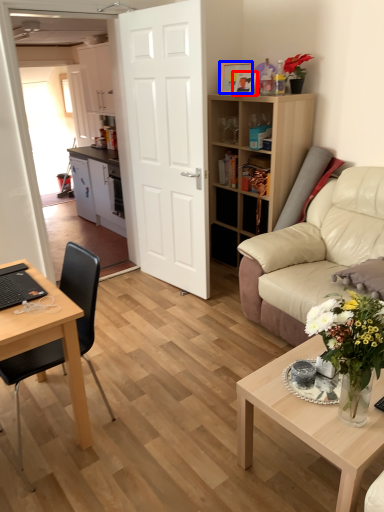
Question: Among these objects, which one is farthest to the camera, picture frame (highlighted by a red box) or picture frame (highlighted by a blue box)?

Choices:
 (A) picture frame
 (B) picture frame

Answer: (B)